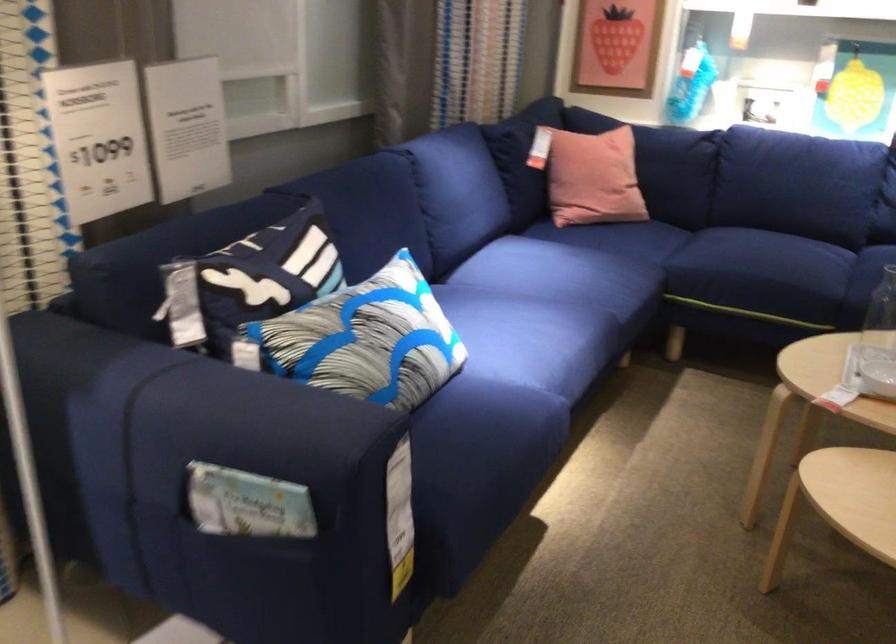
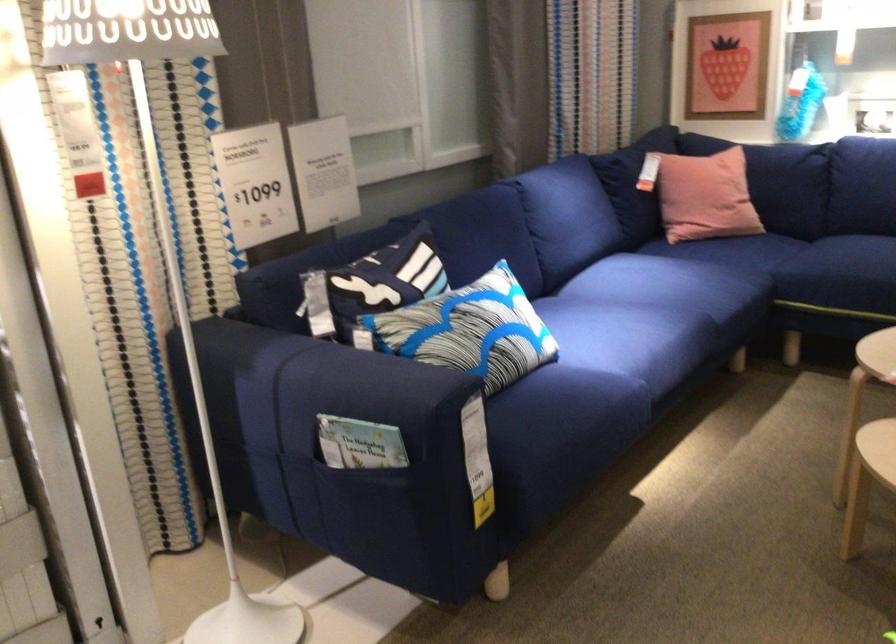
Locate, in the second image, the point that corresponds to point 377,342 in the first image.

(470, 330)